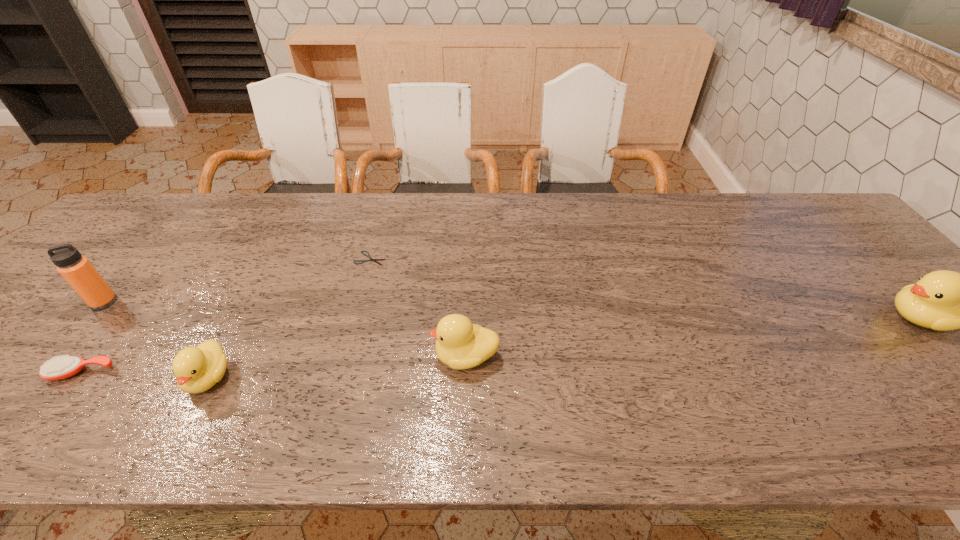
In order to click on vacant space positioned on the beak of the fifth object from left to right in this screenshot , I will do `click(396, 356)`.

Image resolution: width=960 pixels, height=540 pixels. Identify the location of vacant space situated 0.250m on the left of the shears. (265, 258).

Where is `vacant space located 0.280m on the back of the tallest object`? vacant space located 0.280m on the back of the tallest object is located at coordinates (166, 227).

You are a GUI agent. You are given a task and a screenshot of the screen. Output one action in this format:
    pyautogui.click(x=<x>, y=<y>)
    Task: Click on the vacant space located 0.390m on the back of the hairbrush
    The image size is (960, 540).
    Given the screenshot: What is the action you would take?
    pyautogui.click(x=176, y=248)

This screenshot has width=960, height=540. Identify the location of hairbrush at the near edge. (57, 368).

Image resolution: width=960 pixels, height=540 pixels. I want to click on thermos bottle positioned at the left edge, so click(80, 274).

Find the location of `hairbrush present at the left edge`. hairbrush present at the left edge is located at coordinates (57, 368).

You are a GUI agent. You are given a task and a screenshot of the screen. Output one action in this format:
    pyautogui.click(x=<x>, y=<y>)
    Task: Click on the object that is at the near left corner
    The width and height of the screenshot is (960, 540).
    Given the screenshot: What is the action you would take?
    pyautogui.click(x=57, y=368)

Where is `vacant space at the far edge of the desktop`? This screenshot has height=540, width=960. vacant space at the far edge of the desktop is located at coordinates (480, 219).

I want to click on vacant space at the near edge of the desktop, so click(888, 394).